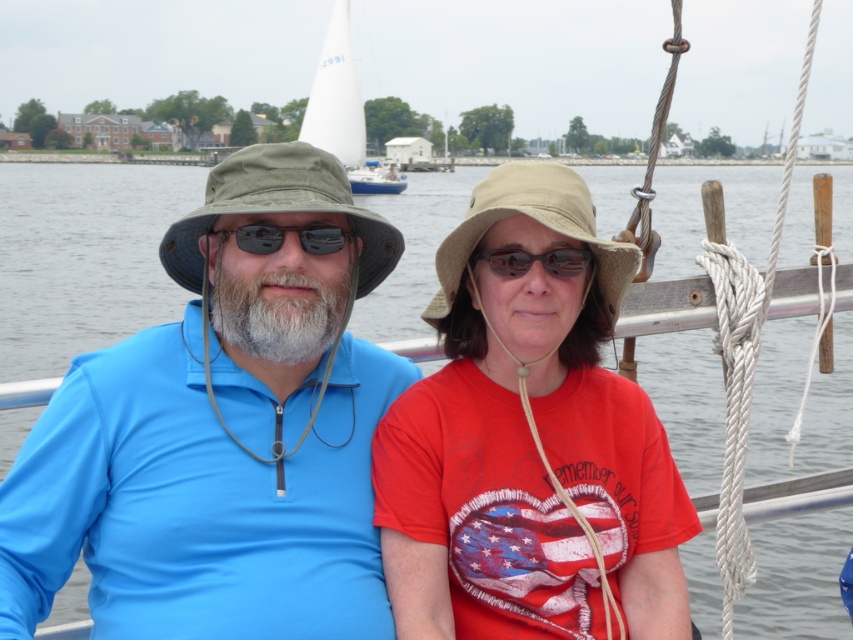
From the picture: You are a photographer planning to take a photo of the white sailboat at upper center and the matte black goggles at center from a drone. The minimum distance between the two objects must be maintained to ensure both are in focus. If your camera has a depth of field that can sharply capture objects within a 100 meter range, will both objects be in focus in the photo?

The white sailboat at upper center and matte black goggles at center are 108.33 meters apart. Since the distance between them exceeds the camera s 100 meter depth of field range, both objects may not be in focus simultaneously in the photo.

You are a photographer trying to capture the sailboat marked with the number 2991 in the distance. You notice a point at coordinates (343, 113) in your viewfinder. Based on the scene, what object is located at that point?

The point at coordinates (343, 113) is on the white sailboat at upper center.